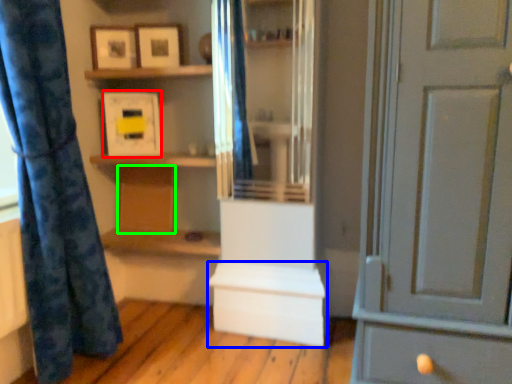
Question: Which object is the farthest from picture frame (highlighted by a red box)? Choose among these: cabinetry (highlighted by a blue box) or cabinetry (highlighted by a green box).

Choices:
 (A) cabinetry
 (B) cabinetry

Answer: (A)